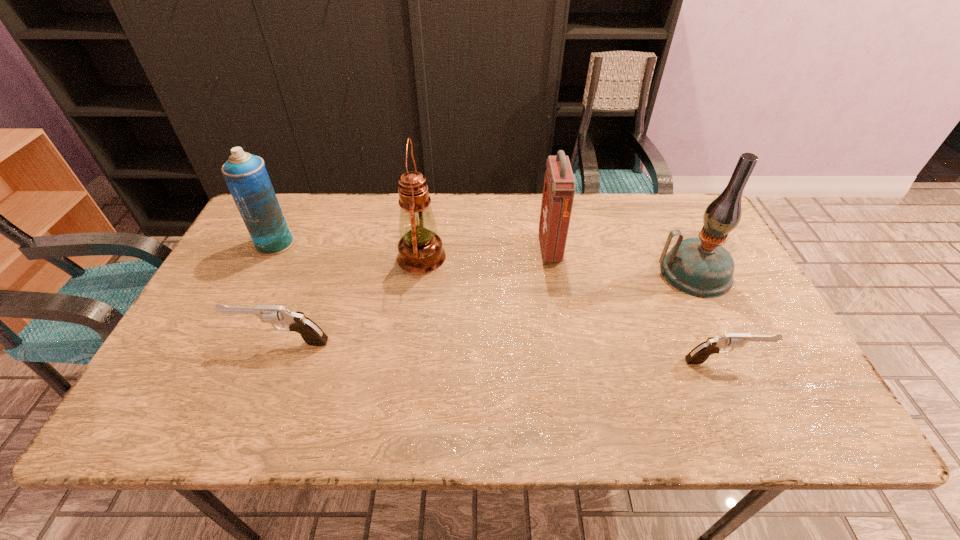
You are a GUI agent. You are given a task and a screenshot of the screen. Output one action in this format:
    pyautogui.click(x=<x>, y=<y>)
    Task: Click on the free space between the shorter gun and the aerosol can
    The height and width of the screenshot is (540, 960).
    Given the screenshot: What is the action you would take?
    [500, 302]

The width and height of the screenshot is (960, 540). What are the coordinates of `vacant area that lies between the third object from left to right and the nearer gun` in the screenshot? It's located at (573, 309).

The height and width of the screenshot is (540, 960). Identify the location of free space between the fifth farthest object and the right oil lamp. (488, 307).

Locate an element on the screen. The height and width of the screenshot is (540, 960). free space between the left oil lamp and the first-aid kit is located at coordinates coord(486,253).

Identify the location of free space that is in between the fourth object from right to left and the first-aid kit. (486, 253).

Image resolution: width=960 pixels, height=540 pixels. What are the coordinates of `free spot between the first-aid kit and the nearer gun` in the screenshot? It's located at (636, 305).

I want to click on free space between the nearer gun and the right oil lamp, so pyautogui.click(x=708, y=317).

Find the location of a particular element. The height and width of the screenshot is (540, 960). unoccupied position between the aerosol can and the right oil lamp is located at coordinates (484, 258).

Find the location of `blank region between the fifth tallest object and the fourth object from left to right`. blank region between the fifth tallest object and the fourth object from left to right is located at coordinates (416, 295).

Identify which object is located as the fourth nearest to the fourth object from right to left. Please provide its 2D coordinates. Your answer should be formatted as a tuple, i.e. [(x, y)], where the tuple contains the x and y coordinates of a point satisfying the conditions above.

[(701, 267)]